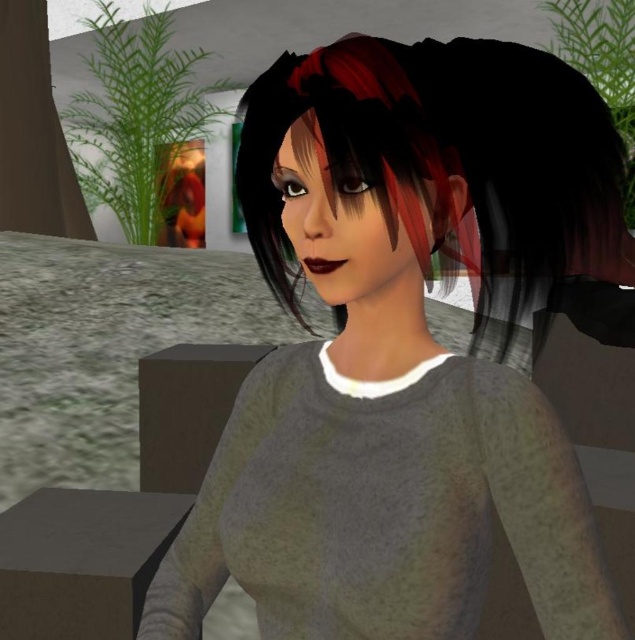
Question: Does matte gray sweater at center appear on the left side of shiny black hair at center?

Choices:
 (A) yes
 (B) no

Answer: (A)

Question: Does matte gray sweater at center appear on the right side of shiny black hair at center?

Choices:
 (A) yes
 (B) no

Answer: (B)

Question: Among these objects, which one is nearest to the camera?

Choices:
 (A) matte gray sweater at center
 (B) shiny black hair at center
 (C) gray matte sweater at center

Answer: (A)

Question: Which object is the closest to the shiny black hair at center?

Choices:
 (A) gray matte sweater at center
 (B) matte gray sweater at center

Answer: (B)

Question: Which point is closer to the camera?

Choices:
 (A) (512, 305)
 (B) (163, 602)
 (C) (265, 570)

Answer: (C)

Question: Is matte gray sweater at center behind shiny black hair at center?

Choices:
 (A) no
 (B) yes

Answer: (A)